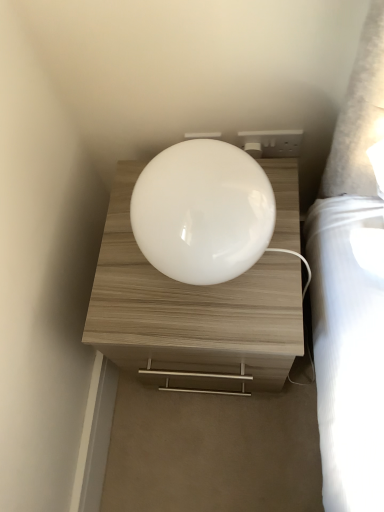
Question: Is white glossy lampshade at center outside of white glossy nightstand at center?

Choices:
 (A) yes
 (B) no

Answer: (A)

Question: Is white glossy nightstand at center at the back of white glossy lampshade at center?

Choices:
 (A) yes
 (B) no

Answer: (B)

Question: Is white glossy lampshade at center at the right side of white glossy nightstand at center?

Choices:
 (A) no
 (B) yes

Answer: (A)

Question: Is white glossy lampshade at center to the left of white glossy nightstand at center from the viewer's perspective?

Choices:
 (A) no
 (B) yes

Answer: (B)

Question: Is white glossy lampshade at center behind white glossy nightstand at center?

Choices:
 (A) no
 (B) yes

Answer: (A)

Question: Is white glossy nightstand at center situated inside white plastic socket at upper right or outside?

Choices:
 (A) outside
 (B) inside

Answer: (A)

Question: From a real-world perspective, is white glossy nightstand at center positioned above or below white plastic socket at upper right?

Choices:
 (A) above
 (B) below

Answer: (B)

Question: Is white glossy nightstand at center taller or shorter than white plastic socket at upper right?

Choices:
 (A) short
 (B) tall

Answer: (B)

Question: Considering the relative positions of white glossy nightstand at center and white plastic socket at upper right in the image provided, is white glossy nightstand at center to the left or to the right of white plastic socket at upper right?

Choices:
 (A) right
 (B) left

Answer: (B)

Question: In terms of width, does white glossy lampshade at center look wider or thinner when compared to white glossy nightstand at center?

Choices:
 (A) thin
 (B) wide

Answer: (A)

Question: Is point (253, 196) positioned closer to the camera than point (188, 295)?

Choices:
 (A) closer
 (B) farther

Answer: (A)

Question: Is white glossy lampshade at center in front of or behind white glossy nightstand at center in the image?

Choices:
 (A) behind
 (B) front

Answer: (B)

Question: In the image, is white glossy lampshade at center on the left side or the right side of white glossy nightstand at center?

Choices:
 (A) right
 (B) left

Answer: (B)

Question: Relative to white glossy nightstand at center, is white plastic socket at upper right in front or behind?

Choices:
 (A) behind
 (B) front

Answer: (A)

Question: From a real-world perspective, is white plastic socket at upper right positioned above or below white glossy nightstand at center?

Choices:
 (A) above
 (B) below

Answer: (A)